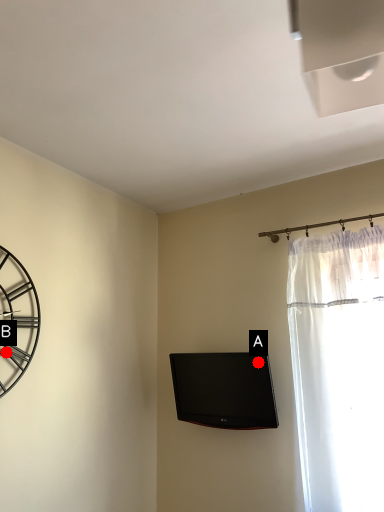
Question: Two points are circled on the image, labeled by A and B beside each circle. Among these points, which one is farthest from the camera?

Choices:
 (A) A is further
 (B) B is further

Answer: (A)